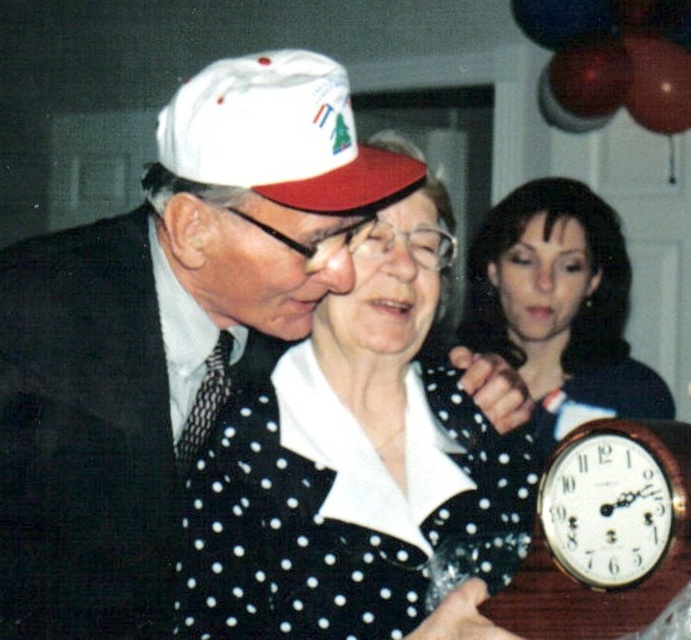
You are a photographer setting up for a group photo. You notice two hats in the frame. The white matte hat at upper left and the white matte baseball cap at upper center. Which hat is taller in the image?

The white matte hat at upper left is taller than the white matte baseball cap at upper center.

You are a photographer at a social event. You need to capture a closeup shot of the white dotted fabric at center and the white matte baseball cap at upper center. Since your camera can only focus on one object at a time, which object should you prioritize to ensure it fits entirely within the frame?

The white dotted fabric at center should be prioritized because its width is larger than the white matte baseball cap at upper center, making it more likely to require a wider focus area to fit entirely within the frame.

You are a photographer at the event and want to capture a clear shot of both the white matte hat at upper left and the white matte baseball cap at upper center. However, you notice one is blocking the other. Which object is closer to the camera?

The white matte hat at upper left is in front of the white matte baseball cap at upper center, so the white matte hat at upper left is closer to the camera.